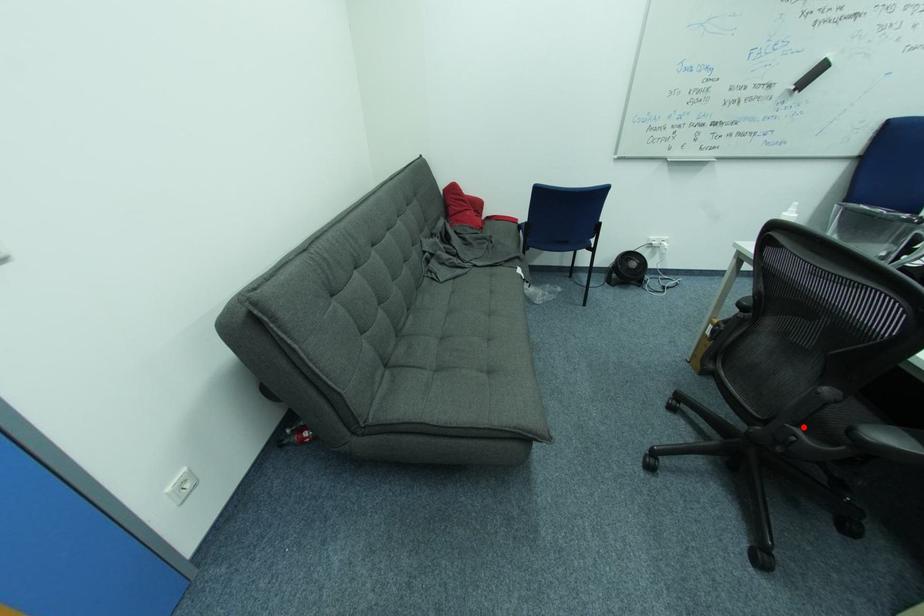
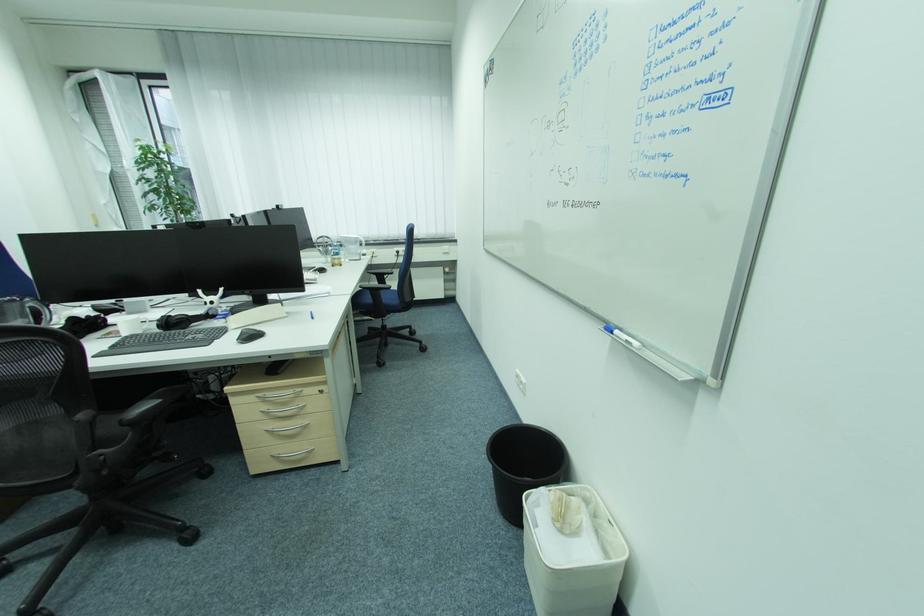
Question: I am providing you with two images of the same scene from different viewpoints. Image1 has a red point marked. In image2, the corresponding 3D location appears at what relative position? Reply with the corresponding letter.

Choices:
 (A) Closer
 (B) Farther

Answer: (A)